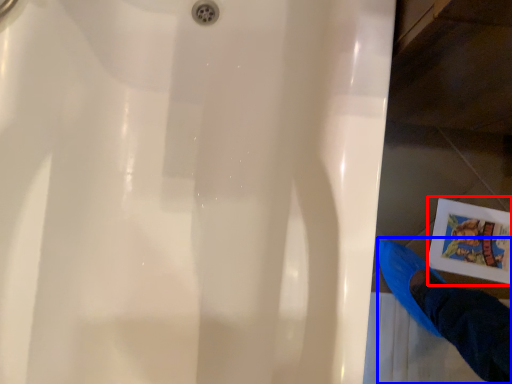
Question: Which object appears closest to the camera in this image, comic book (highlighted by a red box) or person (highlighted by a blue box)?

Choices:
 (A) comic book
 (B) person

Answer: (B)